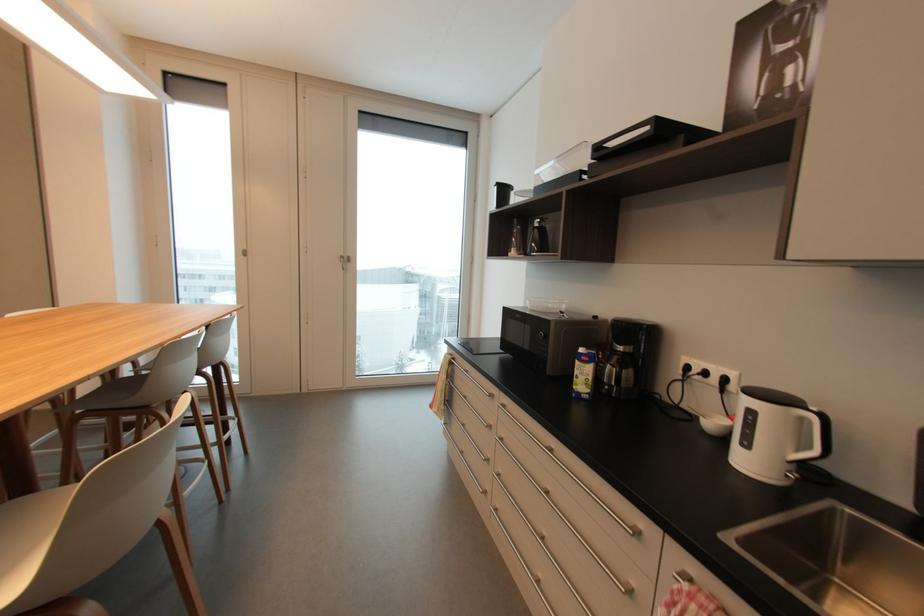
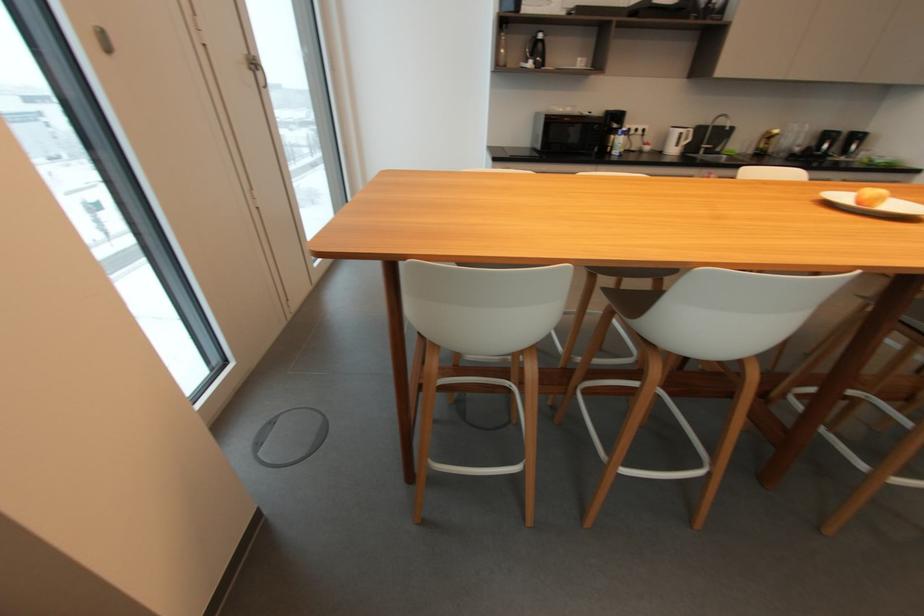
Locate, in the second image, the point that corresponds to [755,413] in the first image.

(685, 134)